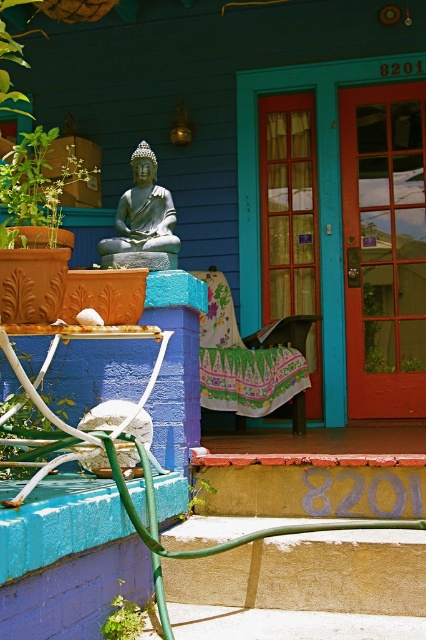
Question: Which object is farther from the camera taking this photo?

Choices:
 (A) green leafy plant at left
 (B) polished bronze statue at center
 (C) floral fabric rocking chair at center
 (D) green leafy plant at lower center

Answer: (C)

Question: Which of the following is the farthest from the observer?

Choices:
 (A) green leafy plant at lower left
 (B) polished bronze statue at center
 (C) green leafy plant at lower center

Answer: (B)

Question: Is floral fabric rocking chair at center smaller than polished bronze statue at center?

Choices:
 (A) no
 (B) yes

Answer: (A)

Question: Which of these objects is positioned closest to the floral fabric rocking chair at center?

Choices:
 (A) green leafy plant at lower left
 (B) polished bronze statue at center

Answer: (B)

Question: In this image, where is green leafy plant at left located relative to green leafy plant at lower left?

Choices:
 (A) right
 (B) left

Answer: (B)

Question: From the image, what is the correct spatial relationship of floral fabric rocking chair at center in relation to green leafy plant at lower center?

Choices:
 (A) below
 (B) above

Answer: (B)